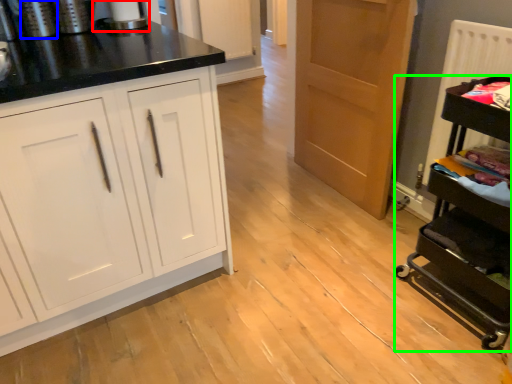
Question: Which object is the closest to the appliance (highlighted by a red box)? Choose among these: appliance (highlighted by a blue box) or appliance (highlighted by a green box).

Choices:
 (A) appliance
 (B) appliance

Answer: (A)